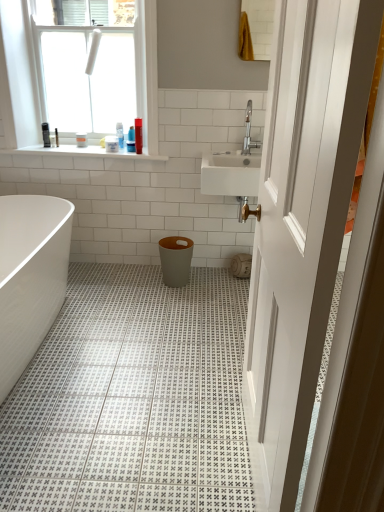
Question: Does silver metallic faucet at upper right come in front of white glossy bathtub at lower left?

Choices:
 (A) no
 (B) yes

Answer: (A)

Question: Considering the relative sizes of silver metallic faucet at upper right and white glossy bathtub at lower left in the image provided, is silver metallic faucet at upper right taller than white glossy bathtub at lower left?

Choices:
 (A) no
 (B) yes

Answer: (A)

Question: Is silver metallic faucet at upper right wider than white glossy bathtub at lower left?

Choices:
 (A) yes
 (B) no

Answer: (B)

Question: From the image's perspective, does silver metallic faucet at upper right appear lower than white glossy bathtub at lower left?

Choices:
 (A) no
 (B) yes

Answer: (A)

Question: Could white glossy bathtub at lower left be considered to be inside silver metallic faucet at upper right?

Choices:
 (A) yes
 (B) no

Answer: (B)

Question: From the image's perspective, is white glossy bathtub at lower left positioned above or below matte gray trash can at center?

Choices:
 (A) above
 (B) below

Answer: (B)

Question: Considering the positions of white glossy bathtub at lower left and matte gray trash can at center in the image, is white glossy bathtub at lower left taller or shorter than matte gray trash can at center?

Choices:
 (A) tall
 (B) short

Answer: (A)

Question: Considering the positions of white glossy bathtub at lower left and matte gray trash can at center in the image, is white glossy bathtub at lower left wider or thinner than matte gray trash can at center?

Choices:
 (A) thin
 (B) wide

Answer: (B)

Question: Considering the positions of white glossy bathtub at lower left and matte gray trash can at center in the image, is white glossy bathtub at lower left bigger or smaller than matte gray trash can at center?

Choices:
 (A) big
 (B) small

Answer: (A)

Question: From the image's perspective, is silver metallic faucet at upper right above or below matte gray trash can at center?

Choices:
 (A) above
 (B) below

Answer: (A)

Question: In the image, is silver metallic faucet at upper right positioned in front of or behind matte gray trash can at center?

Choices:
 (A) front
 (B) behind

Answer: (A)

Question: Considering the positions of point (254, 144) and point (168, 276), is point (254, 144) closer or farther from the camera than point (168, 276)?

Choices:
 (A) closer
 (B) farther

Answer: (A)

Question: Would you say silver metallic faucet at upper right is to the left or to the right of matte gray trash can at center in the picture?

Choices:
 (A) right
 (B) left

Answer: (A)

Question: From the image's perspective, relative to white glossy window at upper left, is white plastic container at upper center above or below?

Choices:
 (A) above
 (B) below

Answer: (B)

Question: Does point (112, 144) appear closer or farther from the camera than point (117, 31)?

Choices:
 (A) farther
 (B) closer

Answer: (A)